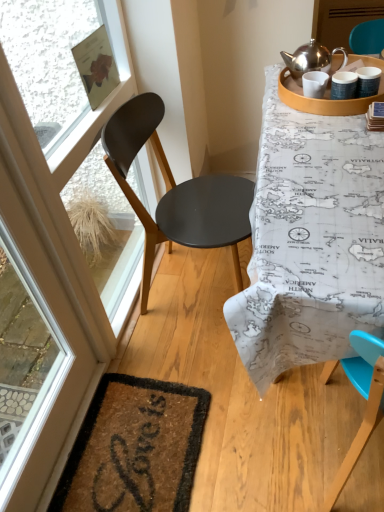
Locate an element on the screen. free point below brown coir mat at lower left (from a real-world perspective) is located at coordinates (142, 454).